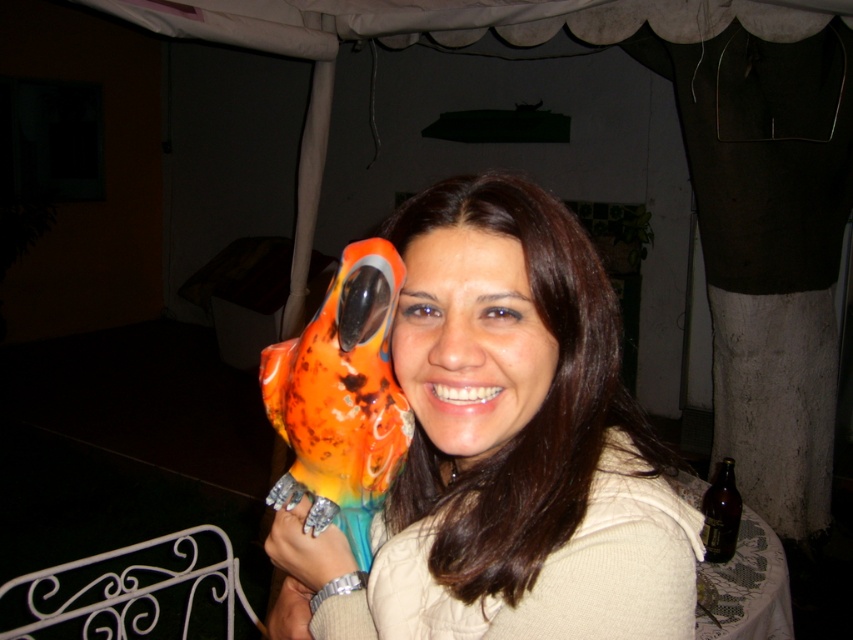
You are setting up a display for a craft fair. You have two parrots to place on a table. The matte ceramic parrot at center and the shiny plastic parrot at left. According to the image, which parrot is placed above the other?

The shiny plastic parrot at left is above the matte ceramic parrot at center because the matte ceramic parrot at center is positioned under the shiny plastic parrot at left.

You are a photographer standing 20 inches away from the matte ceramic parrot at center. Can you move closer to take a better photo without exceeding the minimum safe distance of 18 inches? Please explain your reasoning based on the given information.

The matte ceramic parrot at center is currently 18.81 inches away from the viewer. Since the minimum safe distance is 18 inches, moving closer would bring you within 18 inches or less, which is not allowed. Therefore, you cannot move closer than the current distance of 18.81 inches to avoid exceeding the minimum safe distance requirement.

You are a photographer setting up a shoot under a canopy tent. You have two parrots, a matte ceramic parrot at center and a shiny plastic parrot at left. Which parrot is positioned closer to the right side of the scene?

The matte ceramic parrot at center is positioned closer to the right side of the scene than the shiny plastic parrot at left.